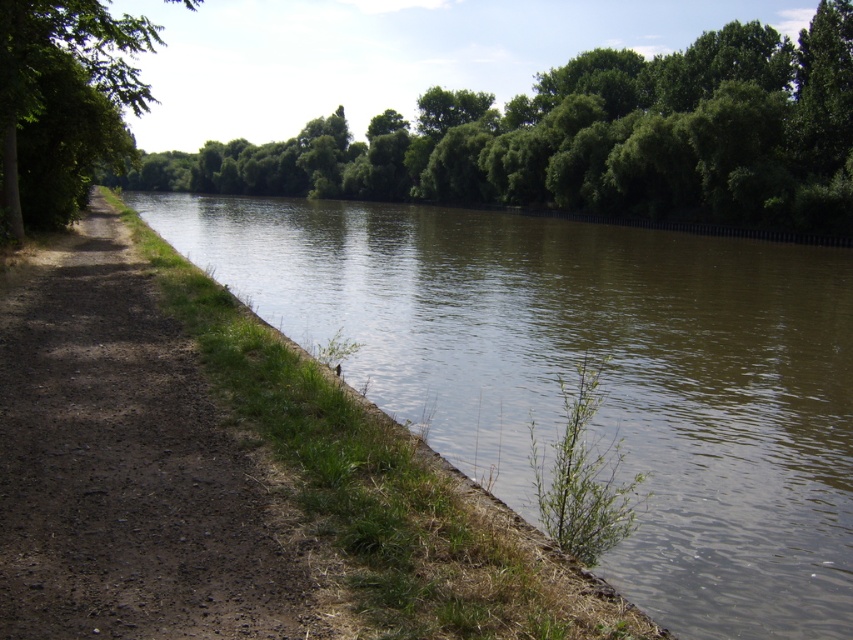
This screenshot has width=853, height=640. Describe the element at coordinates (601, 380) in the screenshot. I see `green grassy river at left` at that location.

Does green grassy river at left have a larger size compared to green leafy tree at left?

No.

This screenshot has height=640, width=853. What do you see at coordinates (601, 380) in the screenshot?
I see `green grassy river at left` at bounding box center [601, 380].

Find the location of a particular element. green grassy river at left is located at coordinates (601, 380).

Is brown dirt path at left above green leafy tree at left?

No.

Which is more to the right, brown dirt path at left or green leafy tree at left?

Positioned to the right is brown dirt path at left.

Does point (199, 628) come farther from viewer compared to point (10, 52)?

No, (199, 628) is closer to viewer.

You are a GUI agent. You are given a task and a screenshot of the screen. Output one action in this format:
    pyautogui.click(x=<x>, y=<y>)
    Task: Click on the brown dirt path at left
    The height and width of the screenshot is (640, 853).
    Given the screenshot: What is the action you would take?
    pyautogui.click(x=126, y=465)

The height and width of the screenshot is (640, 853). I want to click on green leafy tree at upper center, so click(590, 138).

Does point (314, 150) come closer to viewer compared to point (73, 108)?

No, it is behind (73, 108).

I want to click on green leafy tree at upper center, so click(590, 138).